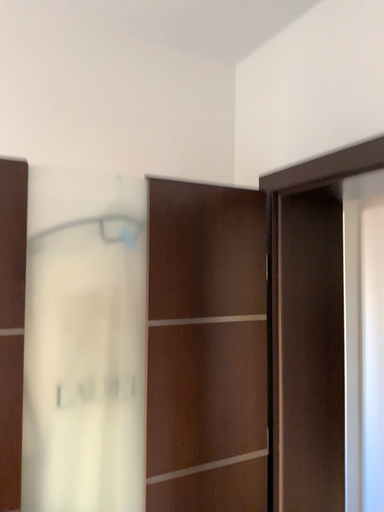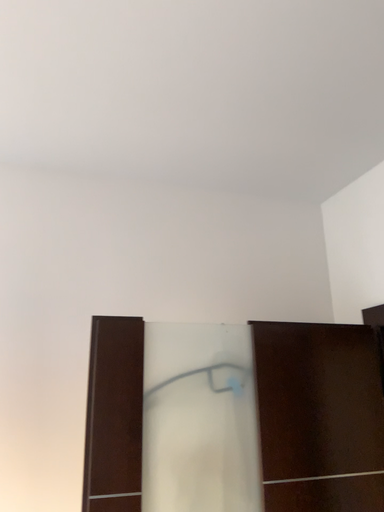
Question: How did the camera likely rotate when shooting the video?

Choices:
 (A) rotated downward
 (B) rotated upward

Answer: (B)